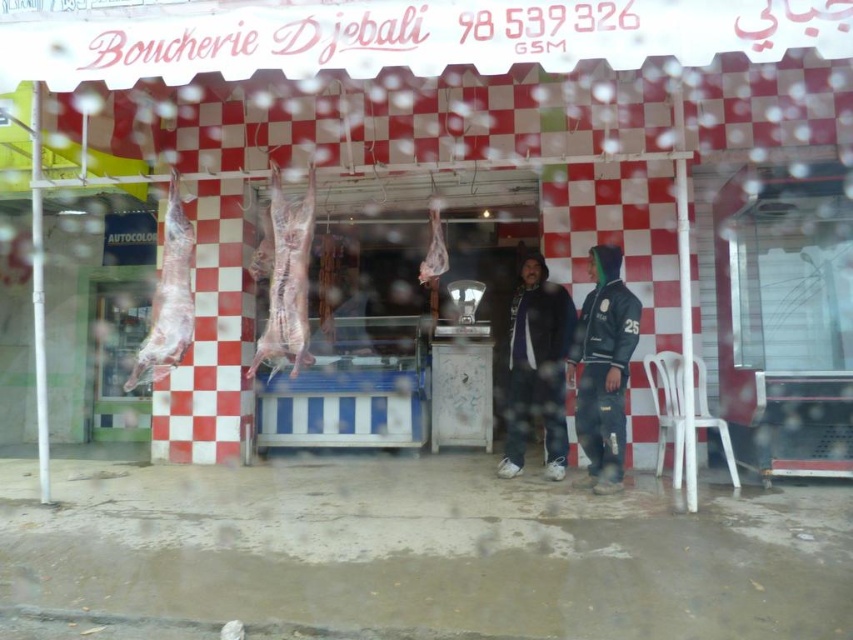
Which is in front, point (567, 362) or point (271, 273)?

Point (271, 273) is in front.

Is dark blue leather jacket at center smaller than pink raw meat at center?

Actually, dark blue leather jacket at center might be larger than pink raw meat at center.

The height and width of the screenshot is (640, 853). What do you see at coordinates (602, 365) in the screenshot?
I see `dark blue leather jacket at center` at bounding box center [602, 365].

This screenshot has width=853, height=640. In order to click on dark blue leather jacket at center in this screenshot , I will do `click(602, 365)`.

Does dark blue jeans at center have a greater height compared to pink raw meat at center?

Correct, dark blue jeans at center is much taller as pink raw meat at center.

Is the position of dark blue jeans at center less distant than that of pink raw meat at center?

No, it is behind pink raw meat at center.

Between point (550, 340) and point (303, 317), which one is positioned in front?

Point (303, 317) is more forward.

Find the location of a particular element. This screenshot has height=640, width=853. dark blue jeans at center is located at coordinates (537, 369).

Does pink raw meat at center appear on the right side of raw meat at left?

Yes, pink raw meat at center is to the right of raw meat at left.

What do you see at coordinates (283, 276) in the screenshot? The image size is (853, 640). I see `pink raw meat at center` at bounding box center [283, 276].

What are the coordinates of `pink raw meat at center` in the screenshot? It's located at (283, 276).